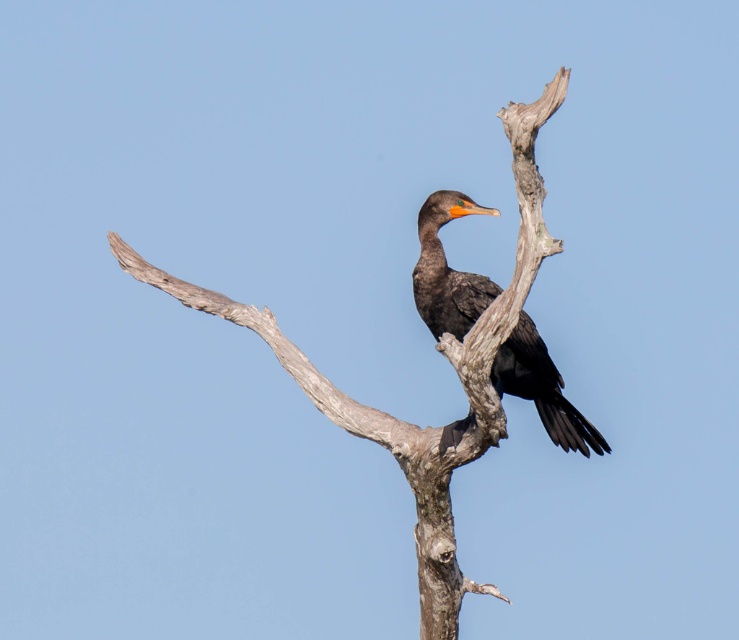
You are a photographer aiming to capture the shiny black bird at center and the smooth gray branch at center in a single shot. Based on their positions, which object should you focus on first to ensure both are in frame?

The smooth gray branch at center is above the shiny black bird at center, so you should focus on the shiny black bird at center first to ensure both are in frame.

You are a birdwatcher trying to identify the species of the shiny black bird at center. You notice that the smooth gray branch at center is larger than the bird. Does this size difference help you determine if the bird is a cormorant?

The smooth gray branch at center is bigger than the shiny black bird at center, which aligns with the typical size of a cormorant. Cormorants are medium to large birds, but in this case, the branch being larger suggests the bird is smaller than average, so this might not be a definitive indicator for identification.

You are standing in a park and see a cormorant bird perched on a smooth gray branch at center. If the branch is 18.54 feet away from you, can you safely throw a small pebble to hit the branch without disturbing the bird?

The smooth gray branch at center is 18.54 feet away from the viewer. Since the distance is relatively far, throwing a small pebble accurately to hit the branch without disturbing the bird might be challenging and could startle it. It is advisable to avoid disturbing wildlife in their natural habitats.